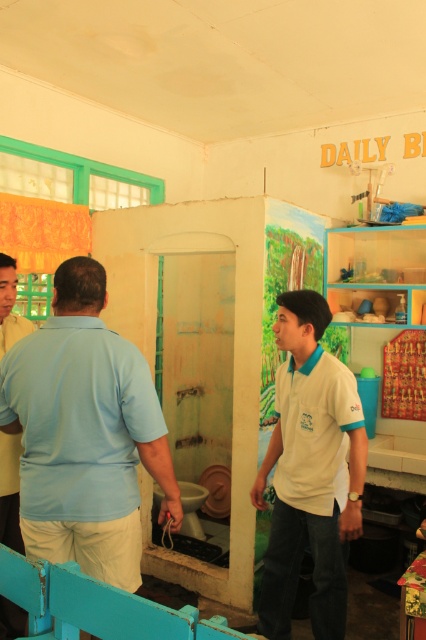
Based on the photo, where is the light blue cotton shirt at center located in the image?

The light blue cotton shirt at center is located at point (85, 433) in the image.

You are a photographer trying to capture a candid shot of both the light blue cotton shirt at center and the white cotton shirt at center. Since you want to ensure both are in focus, which one should you focus on first to maximize the chances of both being clear?

You should focus on the light blue cotton shirt at center first because it is in front of the white cotton shirt at center. By focusing on the closer object, the depth of field may extend backward, potentially keeping both shirts in focus.

You are a tailor measuring the distance between two shirts in a classroom. The shirts are the light blue cotton shirt at center and the white cotton shirt at center. The tailor needs to place them on a 35 inch long table. Will both shirts fit side by side on the table without overlapping?

The light blue cotton shirt at center is 33.62 inches away from the white cotton shirt at center. Since the total required space is 33.62 inches and the table is 35 inches long, both shirts can fit side by side on the table without overlapping.